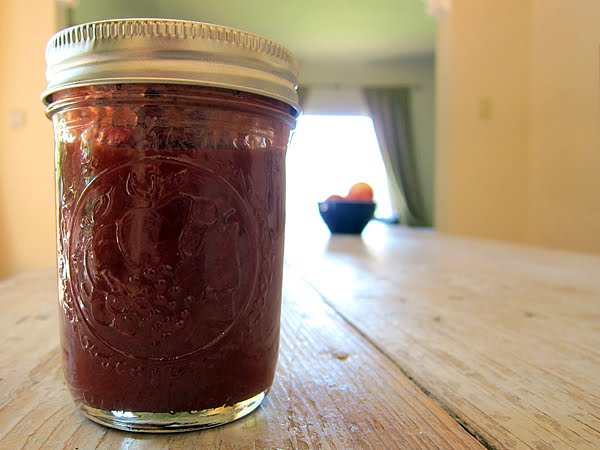
Locate an element on the screen. bowl is located at coordinates (348, 217).